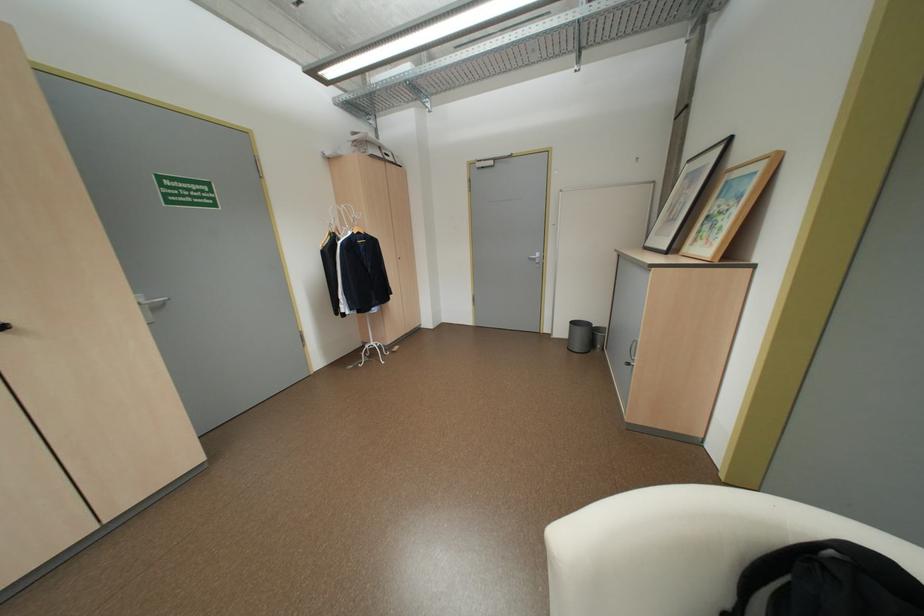
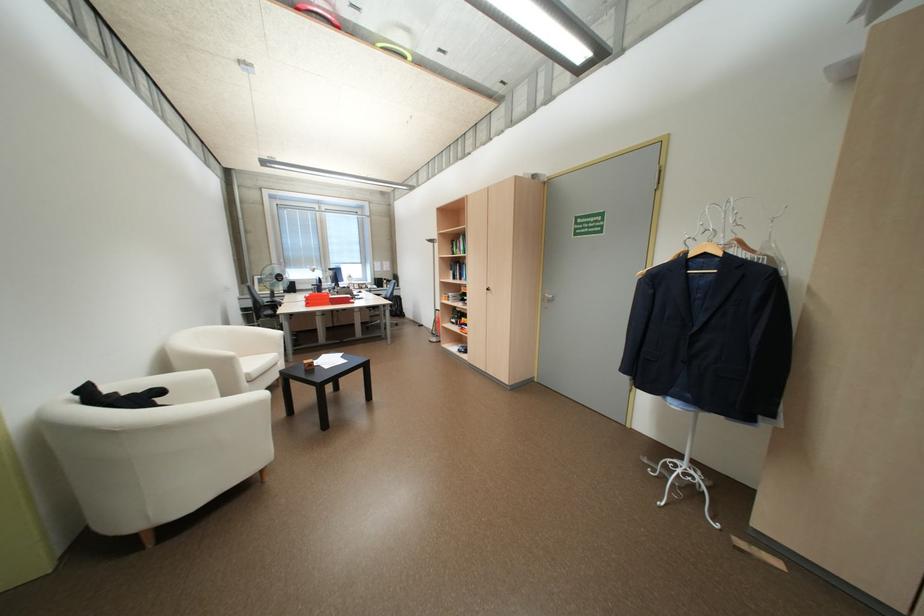
Locate, in the second image, the point that corresponds to (x=369, y=232) in the first image.

(714, 254)